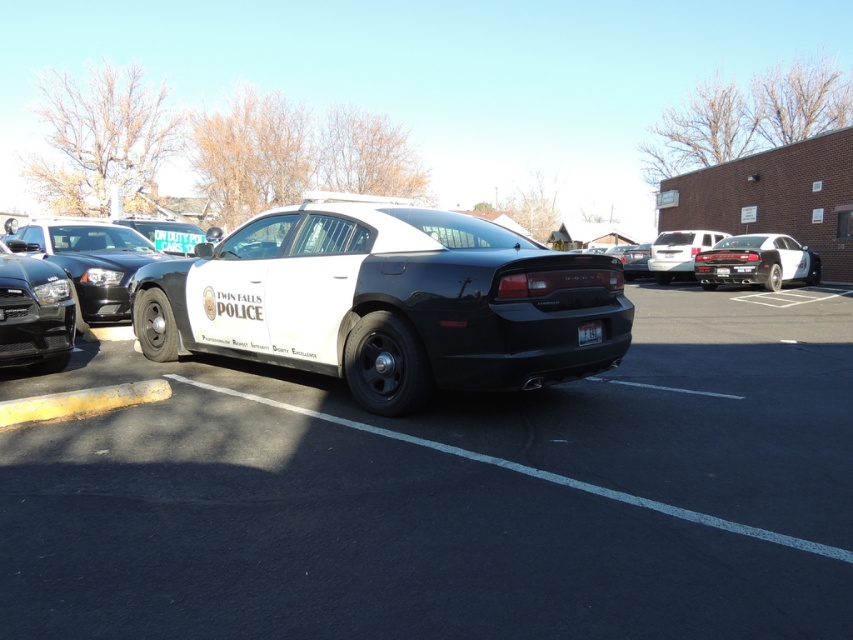
Question: Is black matte police car at center above white glossy sedan at right?

Choices:
 (A) no
 (B) yes

Answer: (A)

Question: Which of the following is the farthest from the observer?

Choices:
 (A) (666, 316)
 (B) (724, 268)

Answer: (B)

Question: Is shiny black car at left below white glossy sedan at right?

Choices:
 (A) no
 (B) yes

Answer: (B)

Question: Which of the following is the farthest from the observer?

Choices:
 (A) (93, 234)
 (B) (577, 328)
 (C) (701, 253)

Answer: (C)

Question: Can you confirm if shiny black car at left is positioned above white plastic license plate at center?

Choices:
 (A) no
 (B) yes

Answer: (B)

Question: Which object is the farthest from the black plastic license plate at center?

Choices:
 (A) black matte police car at center
 (B) white plastic license plate at center

Answer: (A)